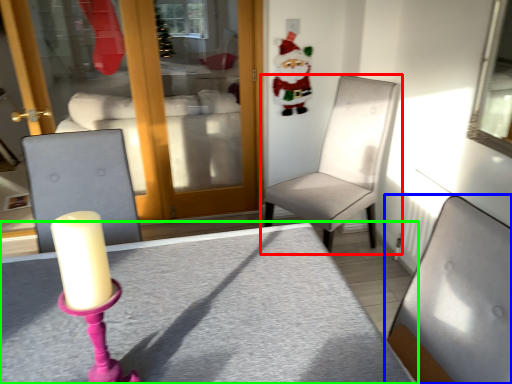
Question: Based on their relative distances, which object is nearer to chair (highlighted by a red box)? Choose from chair (highlighted by a blue box) and table (highlighted by a green box).

Choices:
 (A) chair
 (B) table

Answer: (B)